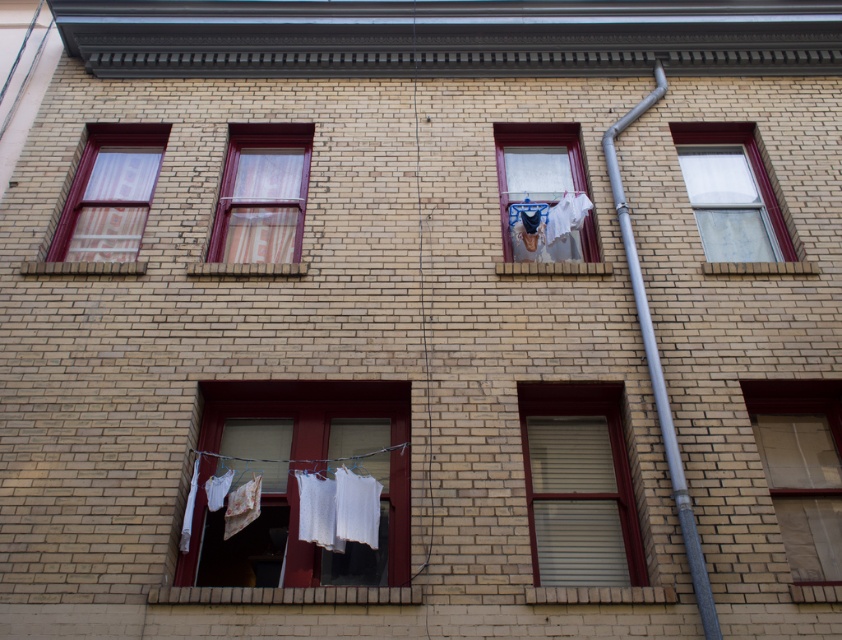
You are a window cleaner with a ladder that can extend up to 6 feet. You need to clean both the white sheer curtain at center and the striped fabric window at center. Can you reach both with your current ladder without moving it?

The distance between the white sheer curtain at center and the striped fabric window at center is 6.58 feet. Since your ladder extends only up to 6 feet, you cannot reach both without moving it.

You are standing in front of the building and notice two points marked on the facade. The first point is at coordinates point (x=285, y=452) and the second is at point (x=729, y=211). Which point is closer to you?

Point (x=285, y=452) is in front of point (x=729, y=211), so it is closer to you.

You are a window cleaner with a ladder that can reach up to 6 feet. You need to clean both the matte glass window at lower right and the matte glass window at upper right. Can you clean both windows with the ladder you have?

The matte glass window at lower right is 5.59 feet from the matte glass window at upper right. Since your ladder can reach up to 6 feet, you can clean both windows with the ladder you have.